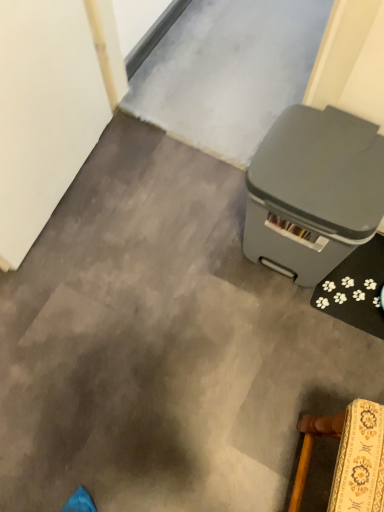
Question: Is point 256,159 closer or farther from the camera than point 342,449?

Choices:
 (A) farther
 (B) closer

Answer: (A)

Question: From a real-world perspective, is gray plastic waste bin at right above or below wooden upholstered chair at lower right?

Choices:
 (A) below
 (B) above

Answer: (A)

Question: Considering the positions of gray plastic waste bin at right and wooden upholstered chair at lower right in the image, is gray plastic waste bin at right taller or shorter than wooden upholstered chair at lower right?

Choices:
 (A) short
 (B) tall

Answer: (A)

Question: Relative to gray plastic waste bin at right, is wooden upholstered chair at lower right in front or behind?

Choices:
 (A) front
 (B) behind

Answer: (A)

Question: Which is correct: wooden upholstered chair at lower right is inside gray plastic waste bin at right, or outside of it?

Choices:
 (A) outside
 (B) inside

Answer: (A)

Question: Considering the positions of wooden upholstered chair at lower right and gray plastic waste bin at right in the image, is wooden upholstered chair at lower right taller or shorter than gray plastic waste bin at right?

Choices:
 (A) short
 (B) tall

Answer: (B)

Question: Is point (342, 478) closer or farther from the camera than point (352, 207)?

Choices:
 (A) closer
 (B) farther

Answer: (A)